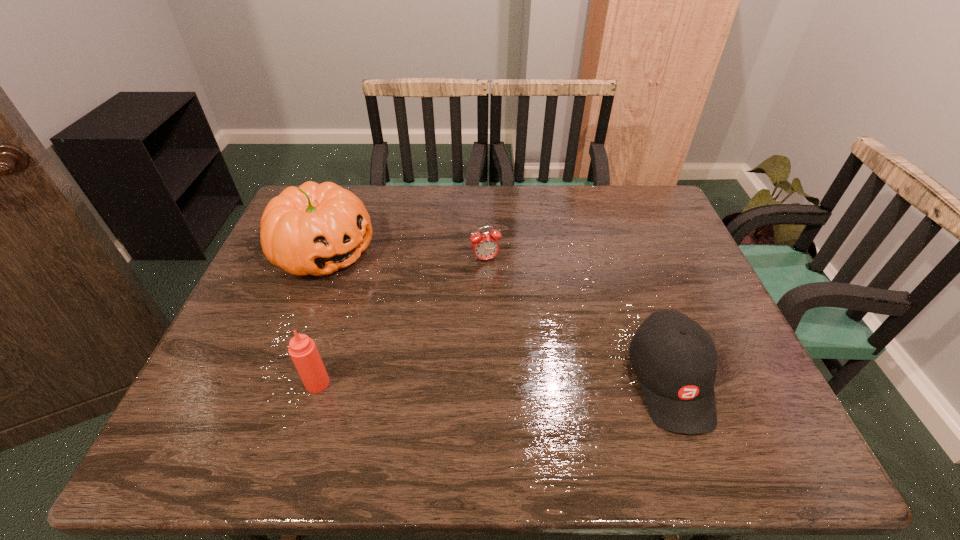
You are a GUI agent. You are given a task and a screenshot of the screen. Output one action in this format:
    pyautogui.click(x=<x>, y=<y>)
    Task: Click on the third shortest object
    The image size is (960, 540).
    Given the screenshot: What is the action you would take?
    pyautogui.click(x=302, y=349)

At what (x,y) coordinates should I click in order to perform the action: click on baseball cap. Please return your answer as a coordinate pair (x, y). The width and height of the screenshot is (960, 540). Looking at the image, I should click on (675, 360).

The image size is (960, 540). I want to click on pumpkin, so click(315, 229).

Image resolution: width=960 pixels, height=540 pixels. In order to click on the second object from right to left in this screenshot , I will do `click(485, 246)`.

Identify the location of free space located on the back of the second tallest object. (342, 304).

What are the coordinates of `free region located 0.110m on the carved face of the pumpkin` in the screenshot? It's located at (388, 290).

This screenshot has width=960, height=540. I want to click on blank space located on the carved face of the pumpkin, so click(380, 285).

Find the location of a particular element. vacant area situated 0.340m on the carved face of the pumpkin is located at coordinates (455, 330).

Image resolution: width=960 pixels, height=540 pixels. I want to click on vacant space located on the face of the alarm clock, so click(x=521, y=356).

Find the location of a particular element. vacant space located on the face of the alarm clock is located at coordinates (503, 303).